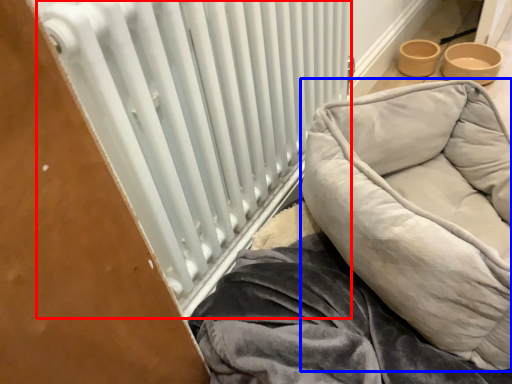
Question: Which of the following is the farthest to the observer, radiator (highlighted by a red box) or furniture (highlighted by a blue box)?

Choices:
 (A) radiator
 (B) furniture

Answer: (B)